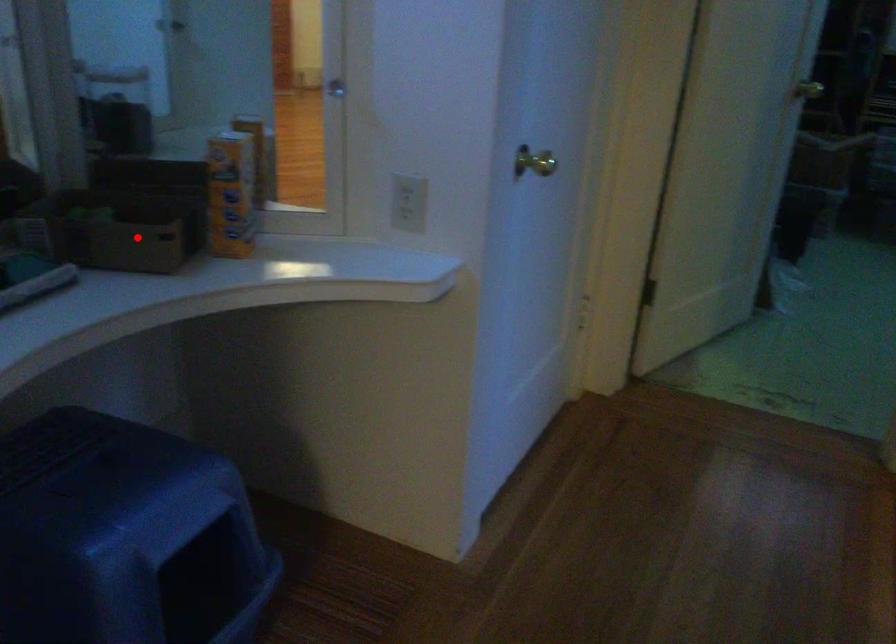
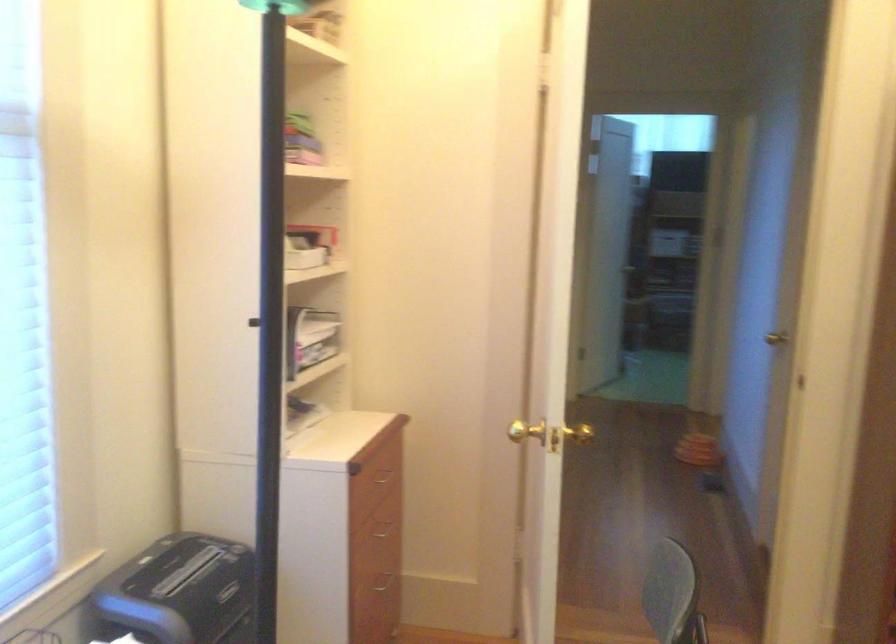
Question: I am providing you with two images of the same scene from different viewpoints. A red point is marked on the first image. At the location where the point appears in image 1, is it still visible in image 2?

Choices:
 (A) Yes
 (B) No

Answer: (B)